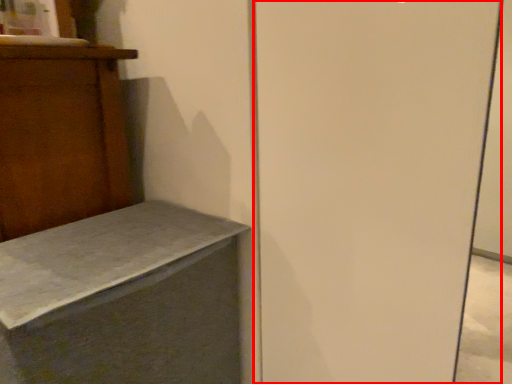
Question: Observing the image, what is the correct spatial positioning of screen door (annotated by the red box) in reference to furniture?

Choices:
 (A) left
 (B) right

Answer: (B)